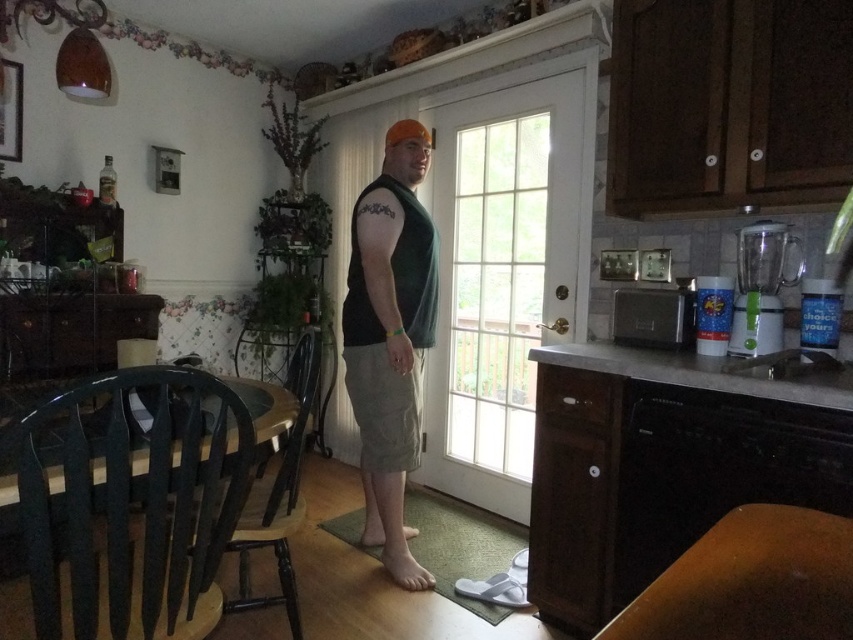
You are a delivery person holding a package that requires a 6 feet clearance to maneuver. You need to move from the green plastic chair at lower left to the clear glass door at center. Can you pass through the space between them without tilting the package?

The distance between the clear glass door at center and the green plastic chair at lower left is 5.49 feet, which is less than the required 6 feet clearance. Therefore, you cannot pass through the space between them without tilting the package.

You are standing at the entrance of the kitchen and want to sit down on the green plastic chair at lower left. Which direction should you move to reach it?

The green plastic chair at lower left is located at point (132, 512), so you should move towards the lower left direction to reach it.

You are organizing a small outdoor gathering and need to move the green plastic chair at lower left and the green matte tank top at center to the deck outside. The door to the deck is on the right side of the image. Which object should you move first to ensure easier access to the door?

The green plastic chair at lower left should be moved first because it is positioned to the left of the green matte tank top at center, making it closer to the door on the right side of the image.